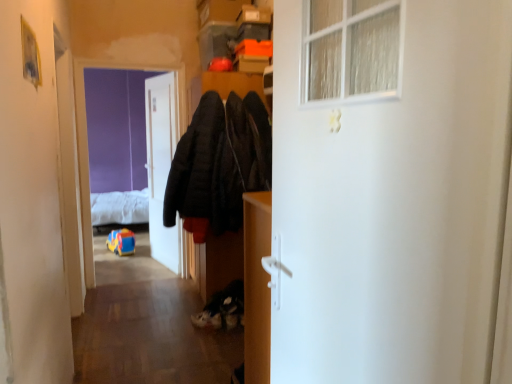
Question: Can you confirm if white fluffy bed at upper left is positioned to the left of matte wood cabinet at center?

Choices:
 (A) no
 (B) yes

Answer: (B)

Question: Is white fluffy bed at upper left oriented away from matte wood cabinet at center?

Choices:
 (A) no
 (B) yes

Answer: (A)

Question: Does white fluffy bed at upper left have a smaller size compared to matte wood cabinet at center?

Choices:
 (A) no
 (B) yes

Answer: (A)

Question: Can you confirm if white fluffy bed at upper left is positioned to the right of matte wood cabinet at center?

Choices:
 (A) no
 (B) yes

Answer: (A)

Question: Is white fluffy bed at upper left next to matte wood cabinet at center and touching it?

Choices:
 (A) no
 (B) yes

Answer: (A)

Question: Is matte wood cabinet at center in front of or behind white fluffy bed at upper left in the image?

Choices:
 (A) front
 (B) behind

Answer: (A)

Question: Based on their sizes in the image, would you say matte wood cabinet at center is bigger or smaller than white fluffy bed at upper left?

Choices:
 (A) small
 (B) big

Answer: (A)

Question: Is matte wood cabinet at center wider or thinner than white fluffy bed at upper left?

Choices:
 (A) wide
 (B) thin

Answer: (B)

Question: Is matte wood cabinet at center taller or shorter than white fluffy bed at upper left?

Choices:
 (A) short
 (B) tall

Answer: (B)

Question: Visually, is dark matte coat at center positioned to the left or to the right of white fluffy bed at upper left?

Choices:
 (A) right
 (B) left

Answer: (A)

Question: Choose the correct answer: Is dark matte coat at center inside white fluffy bed at upper left or outside it?

Choices:
 (A) outside
 (B) inside

Answer: (A)

Question: From the image's perspective, relative to white fluffy bed at upper left, is dark matte coat at center above or below?

Choices:
 (A) above
 (B) below

Answer: (A)

Question: Based on their sizes in the image, would you say dark matte coat at center is bigger or smaller than white fluffy bed at upper left?

Choices:
 (A) big
 (B) small

Answer: (B)

Question: From the image's perspective, is purple matte screen door at upper left above or below dark matte coat at center?

Choices:
 (A) below
 (B) above

Answer: (A)

Question: Looking at their shapes, would you say purple matte screen door at upper left is wider or thinner than dark matte coat at center?

Choices:
 (A) thin
 (B) wide

Answer: (A)